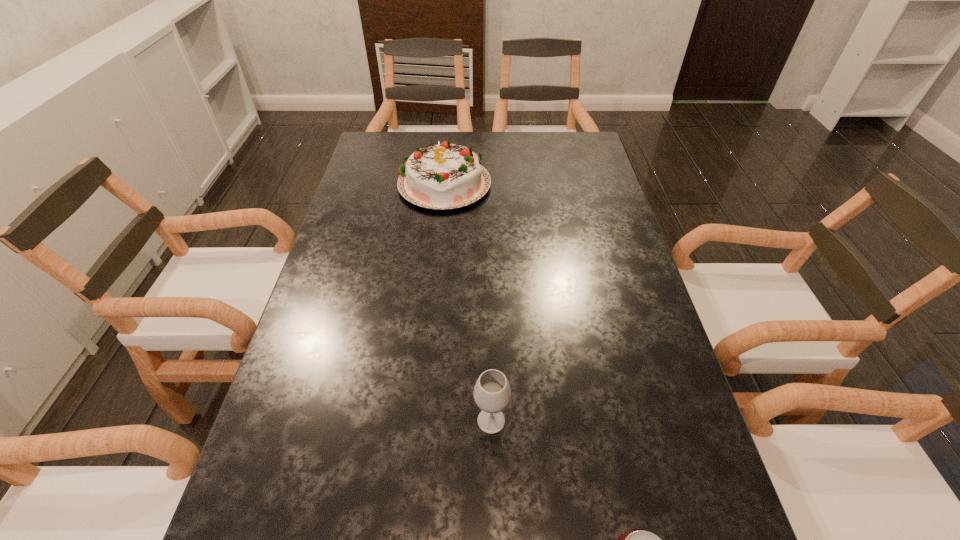
Image resolution: width=960 pixels, height=540 pixels. In the image, there is a desktop. What are the coordinates of `vacant area at the far left corner` in the screenshot? It's located at (394, 143).

At what (x,y) coordinates should I click in order to perform the action: click on free space at the far right corner of the desktop. Please return your answer as a coordinate pair (x, y). The width and height of the screenshot is (960, 540). Looking at the image, I should click on (575, 139).

Identify the location of free space between the cake and the second farthest object. (468, 302).

Locate an element on the screen. Image resolution: width=960 pixels, height=540 pixels. empty location between the second farthest object and the cake is located at coordinates (468, 302).

Locate an element on the screen. The image size is (960, 540). empty space between the farthest object and the second farthest object is located at coordinates (468, 302).

Find the location of a particular element. unoccupied area between the cake and the wineglass is located at coordinates (468, 302).

The width and height of the screenshot is (960, 540). Find the location of `empty space that is in between the cake and the second nearest object`. empty space that is in between the cake and the second nearest object is located at coordinates (468, 302).

Choose which object is the second nearest neighbor to the farthest object. Please provide its 2D coordinates. Your answer should be formatted as a tuple, i.e. [(x, y)], where the tuple contains the x and y coordinates of a point satisfying the conditions above.

[(635, 539)]

The image size is (960, 540). What are the coordinates of `object that is the closest to the farthest object` in the screenshot? It's located at (492, 393).